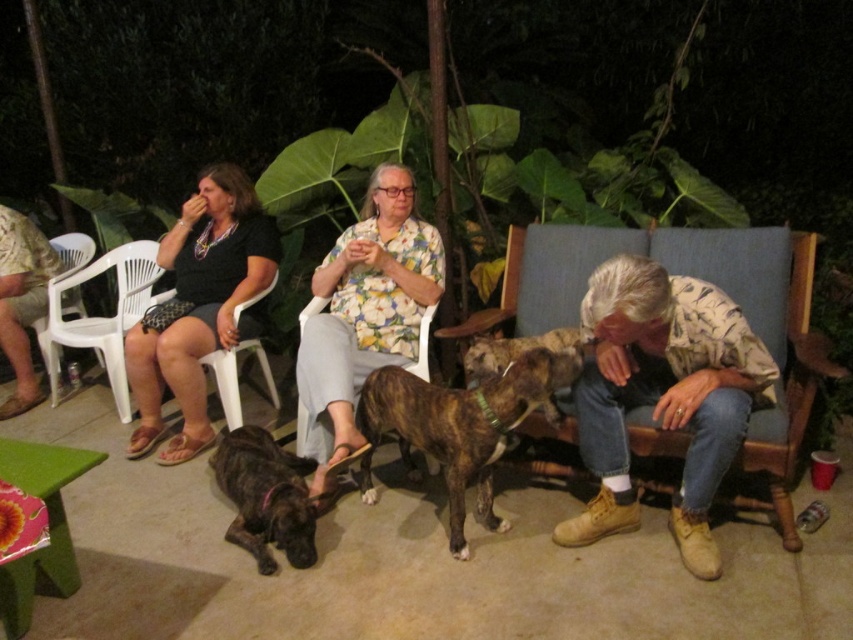
You are a guest at the outdoor gathering and want to pet the braided fur dog at center without disturbing the wooden rocking chair at center. Can you reach the dog while staying in your current position?

The wooden rocking chair at center is 17.22 inches from braided fur dog at center. Since this distance is relatively close, you can likely reach the dog without moving your position, as 17.22 inches is within an arm span for most people.

You are standing in the middle of the patio and want to pick up the leather boots at lower right and the white plastic chair at lower left. Which object is closer to you?

The leather boots at lower right is closer to the viewer than the white plastic chair at lower left, so you can reach the leather boots at lower right first.